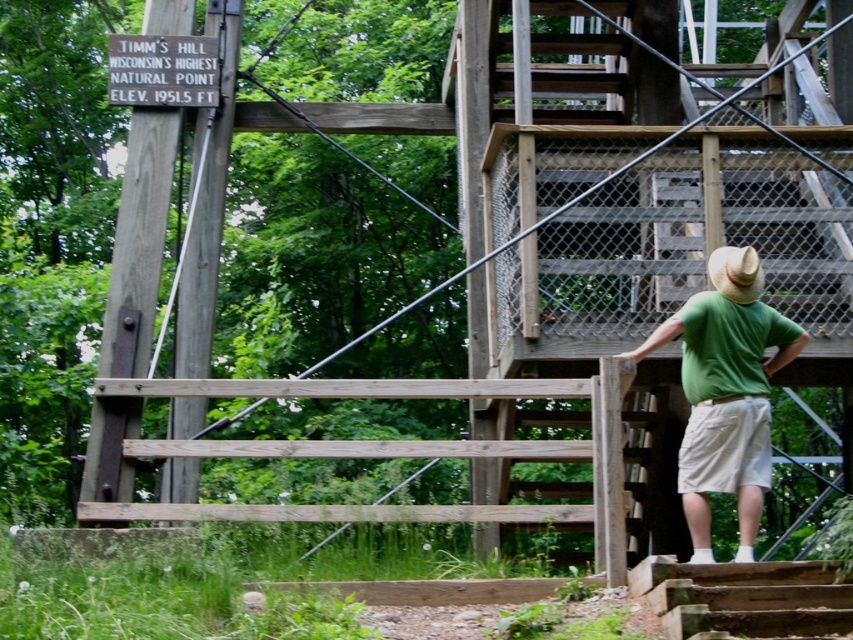
Question: Which point is closer to the camera taking this photo?

Choices:
 (A) (720, 326)
 (B) (751, 604)

Answer: (B)

Question: Can you confirm if green matte shirt at right is positioned to the right of wooden stairs at lower right?

Choices:
 (A) no
 (B) yes

Answer: (B)

Question: Is green matte shirt at right behind wooden stairs at lower right?

Choices:
 (A) no
 (B) yes

Answer: (B)

Question: Can you confirm if green matte shirt at right is thinner than wooden stairs at lower right?

Choices:
 (A) yes
 (B) no

Answer: (A)

Question: Which of the following is the closest to the observer?

Choices:
 (A) wooden stairs at lower right
 (B) green matte shirt at right

Answer: (A)